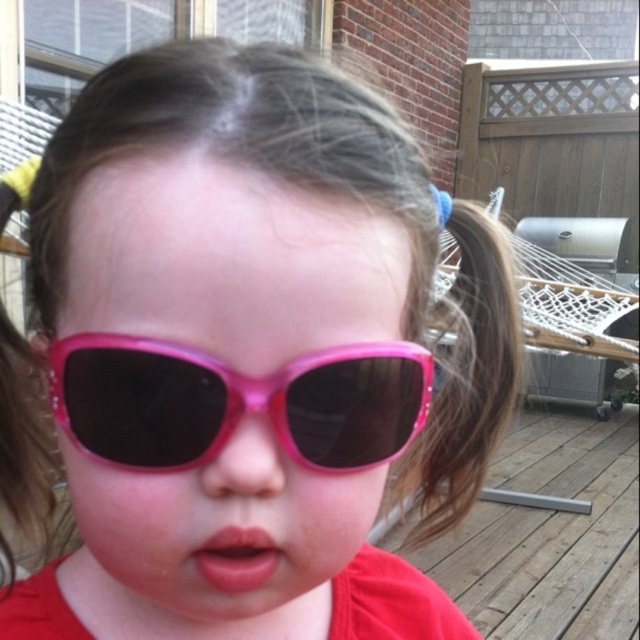
Consider the image. Can you confirm if pink plastic sunglasses at center is wider than pink glossy lips at center?

Indeed, pink plastic sunglasses at center has a greater width compared to pink glossy lips at center.

Is pink plastic sunglasses at center smaller than pink glossy lips at center?

No.

Find the location of a particular element. This screenshot has width=640, height=640. pink plastic sunglasses at center is located at coordinates (236, 403).